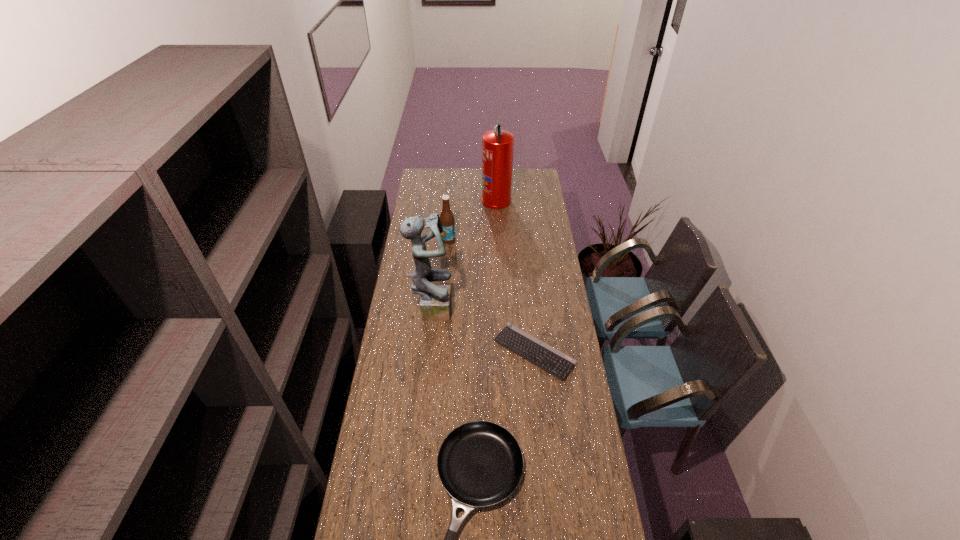
Where is `unoccupied area between the fire extinguisher and the second farthest object`? This screenshot has width=960, height=540. unoccupied area between the fire extinguisher and the second farthest object is located at coordinates (472, 220).

Locate an element on the screen. The height and width of the screenshot is (540, 960). vacant space that is in between the third farthest object and the computer keyboard is located at coordinates (483, 329).

Image resolution: width=960 pixels, height=540 pixels. What are the coordinates of `vacant area between the farthest object and the shortest object` in the screenshot? It's located at (516, 276).

Identify the location of free space between the fire extinguisher and the fourth nearest object. Image resolution: width=960 pixels, height=540 pixels. (472, 220).

Choose which object is the second nearest neighbor to the nearest object. Please provide its 2D coordinates. Your answer should be formatted as a tuple, i.e. [(x, y)], where the tuple contains the x and y coordinates of a point satisfying the conditions above.

[(435, 303)]

Identify the location of object that stands as the second closest to the fourth farthest object. This screenshot has width=960, height=540. (480, 463).

In order to click on free spot that satisfies the following two spatial constraints: 1. on the instruction side of the shortest object; 2. on the left side of the farthest object in this screenshot , I will do `click(503, 352)`.

Find the location of a particular element. The image size is (960, 540). vacant space that satisfies the following two spatial constraints: 1. on the front side of the third tallest object; 2. on the face of the sculpture is located at coordinates (443, 307).